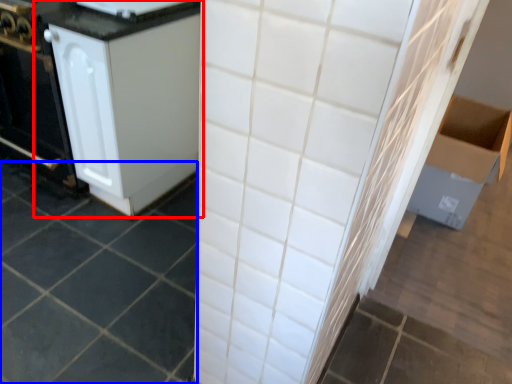
Question: Among these objects, which one is farthest to the camera, cabinetry (highlighted by a red box) or ceramic tile (highlighted by a blue box)?

Choices:
 (A) cabinetry
 (B) ceramic tile

Answer: (A)